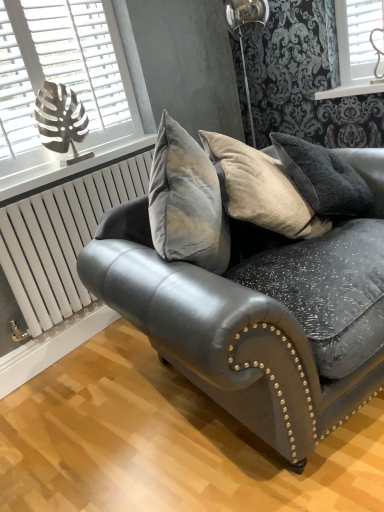
Question: Is metallic silver leaf at upper left positioned with its back to white painted wood at upper center?

Choices:
 (A) yes
 (B) no

Answer: (B)

Question: Is metallic silver leaf at upper left aimed at white painted wood at upper center?

Choices:
 (A) yes
 (B) no

Answer: (B)

Question: Is metallic silver leaf at upper left far from white painted wood at upper center?

Choices:
 (A) no
 (B) yes

Answer: (B)

Question: Is metallic silver leaf at upper left to the right of white painted wood at upper center from the viewer's perspective?

Choices:
 (A) yes
 (B) no

Answer: (B)

Question: Does metallic silver leaf at upper left come behind white painted wood at upper center?

Choices:
 (A) yes
 (B) no

Answer: (B)

Question: Is metallic silver leaf at upper left wider than white painted wood at upper center?

Choices:
 (A) yes
 (B) no

Answer: (B)

Question: Can you confirm if metallic leaf-shaped object at upper left is bigger than white metallic radiator at lower left?

Choices:
 (A) yes
 (B) no

Answer: (B)

Question: Can you confirm if metallic leaf-shaped object at upper left is positioned to the left of white metallic radiator at lower left?

Choices:
 (A) no
 (B) yes

Answer: (B)

Question: Is metallic leaf-shaped object at upper left facing towards white metallic radiator at lower left?

Choices:
 (A) yes
 (B) no

Answer: (B)

Question: Can you confirm if metallic leaf-shaped object at upper left is taller than white metallic radiator at lower left?

Choices:
 (A) no
 (B) yes

Answer: (A)

Question: Is metallic leaf-shaped object at upper left positioned with its back to white metallic radiator at lower left?

Choices:
 (A) yes
 (B) no

Answer: (B)

Question: Is metallic leaf-shaped object at upper left thinner than white metallic radiator at lower left?

Choices:
 (A) yes
 (B) no

Answer: (A)

Question: Is velvet grey couch at center located outside white metallic radiator at lower left?

Choices:
 (A) yes
 (B) no

Answer: (A)